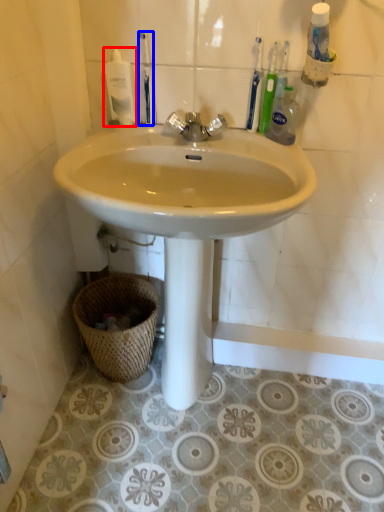
Question: Among these objects, which one is nearest to the camera, mouthwash (highlighted by a red box) or toothbrush (highlighted by a blue box)?

Choices:
 (A) mouthwash
 (B) toothbrush

Answer: (B)